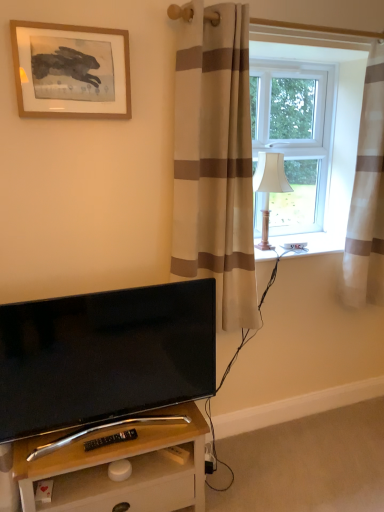
Find the location of a particular element. Image resolution: width=384 pixels, height=512 pixels. vacant space to the left of black plastic remote control at lower center is located at coordinates (64, 459).